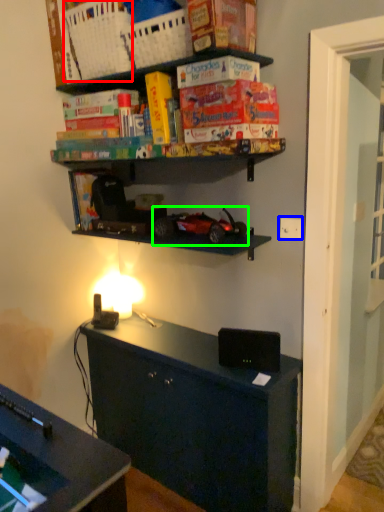
Question: Which object is positioned farthest from basket (highlighted by a red box)? Select from electric outlet (highlighted by a blue box) and model car (highlighted by a green box).

Choices:
 (A) electric outlet
 (B) model car

Answer: (A)